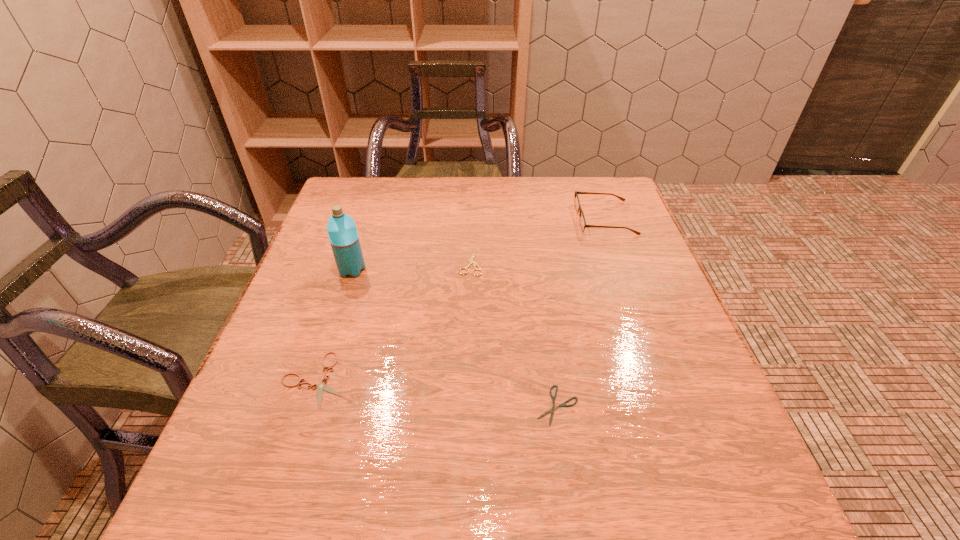
Image resolution: width=960 pixels, height=540 pixels. Find the location of `object positioned at the far right corner`. object positioned at the far right corner is located at coordinates (583, 225).

This screenshot has height=540, width=960. I want to click on vacant space at the far edge of the desktop, so click(x=455, y=220).

Where is `blank area at the left edge`? blank area at the left edge is located at coordinates (314, 301).

The height and width of the screenshot is (540, 960). I want to click on vacant space at the right edge of the desktop, so point(633,407).

The height and width of the screenshot is (540, 960). In the image, there is a desktop. What are the coordinates of `vacant area at the far right corner` in the screenshot? It's located at (564, 185).

At what (x,y) coordinates should I click in order to perform the action: click on free space between the rightmost object and the thermos bottle. Please return your answer as a coordinate pair (x, y). This screenshot has height=540, width=960. Looking at the image, I should click on (478, 244).

This screenshot has width=960, height=540. In order to click on free space between the tallest object and the leftmost shears in this screenshot , I will do 333,325.

This screenshot has height=540, width=960. I want to click on free area in between the fourth tallest object and the tallest object, so click(333, 325).

Where is `vacant space that is in between the tallest shears and the rightmost shears`? This screenshot has width=960, height=540. vacant space that is in between the tallest shears and the rightmost shears is located at coordinates (514, 334).

The width and height of the screenshot is (960, 540). Find the location of `vacant space that's between the third tallest object and the fourth tallest object`. vacant space that's between the third tallest object and the fourth tallest object is located at coordinates (393, 320).